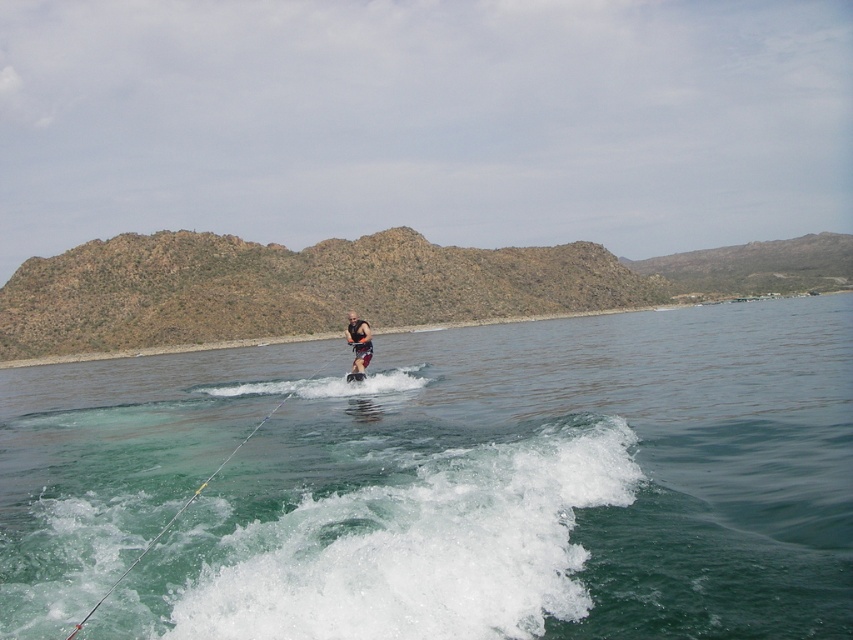
From the picture: You are a photographer trying to capture the perfect shot of the water skiing scene. You notice the clear water at center and the metallic silver rope at lower center. From the photographer perspective, which object is positioned more to the right side of the frame?

The clear water at center is positioned more to the right of the frame compared to the metallic silver rope at lower center.